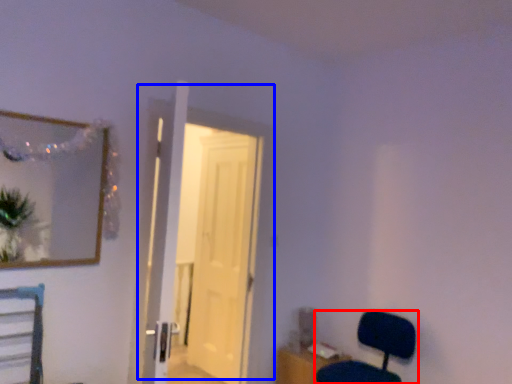
Question: Which object appears closest to the camera in this image, chair (highlighted by a red box) or door (highlighted by a blue box)?

Choices:
 (A) chair
 (B) door

Answer: (A)